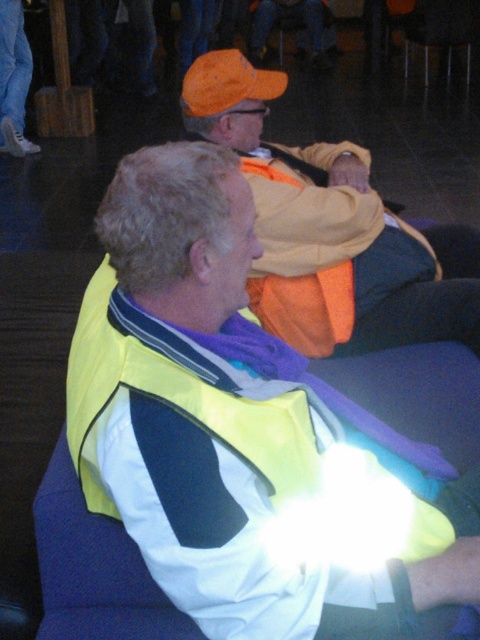
Question: Among these points, which one is farthest from the camera?

Choices:
 (A) (269, 0)
 (B) (94, 384)

Answer: (A)

Question: Which point is closer to the camera taking this photo?

Choices:
 (A) (25, 83)
 (B) (443, 304)
 (C) (248, 620)
 (D) (302, 26)

Answer: (C)

Question: Can you confirm if orange fabric vest at upper center is bigger than orange reflective vest at center?

Choices:
 (A) yes
 (B) no

Answer: (A)

Question: Estimate the real-world distances between objects in this image. Which object is farther from the orange reflective vest at center?

Choices:
 (A) orange fabric vest at upper center
 (B) high-visibility fabric vest at center

Answer: (B)

Question: Is orange fabric vest at upper center thinner than matte orange cap at upper center?

Choices:
 (A) yes
 (B) no

Answer: (B)

Question: Can you confirm if high-visibility fabric vest at center is positioned to the left of matte orange cap at upper center?

Choices:
 (A) no
 (B) yes

Answer: (A)